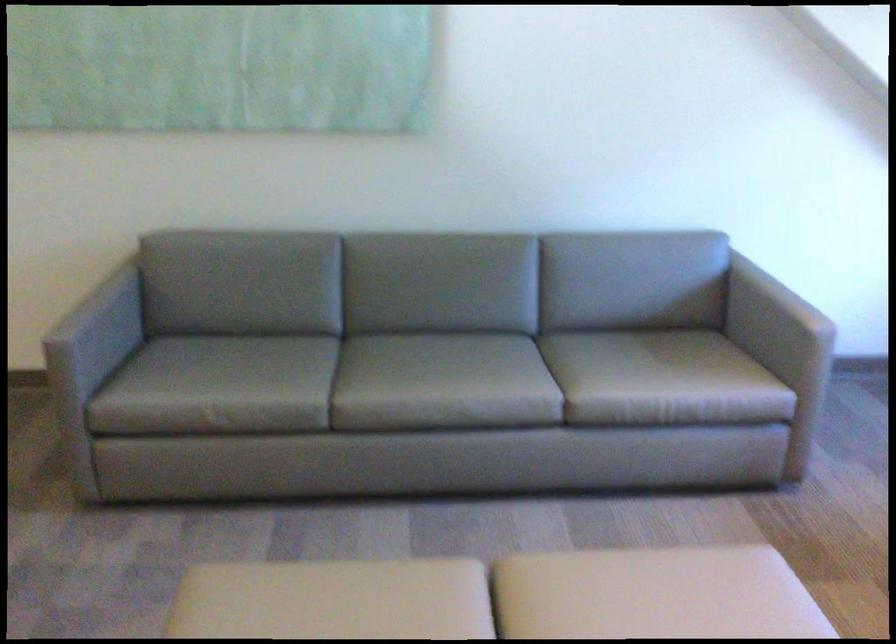
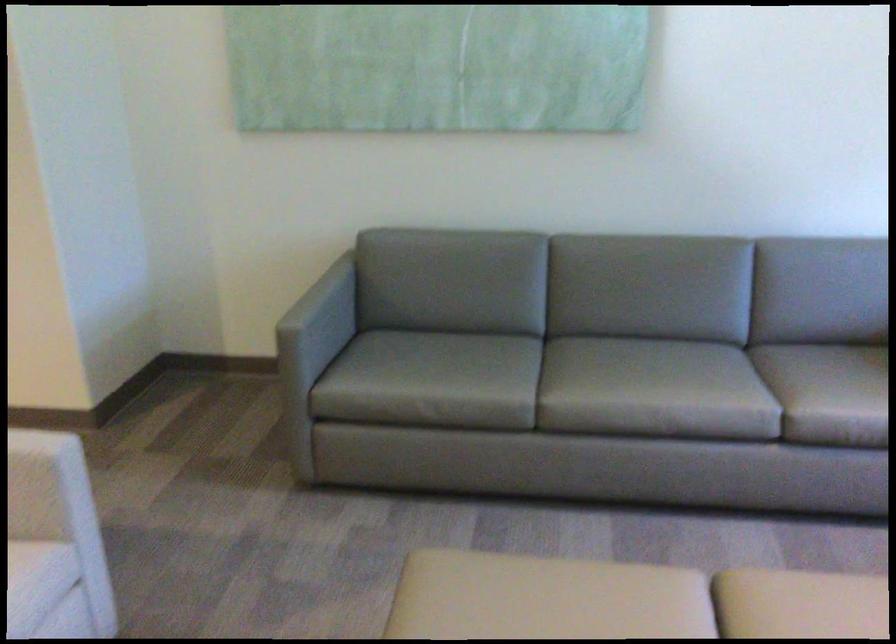
In the second image, find the point that corresponds to pixel 407 384 in the first image.

(613, 386)